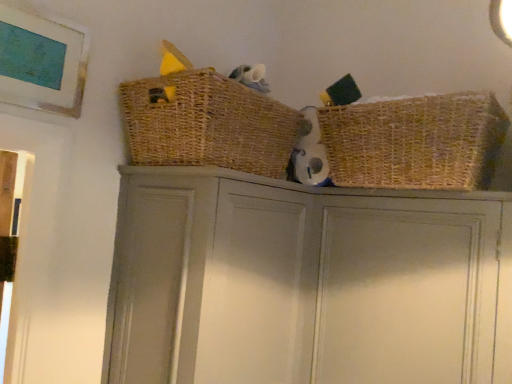
What do you see at coordinates (399, 297) in the screenshot? This screenshot has height=384, width=512. I see `matte gray cabinet door at upper center` at bounding box center [399, 297].

Describe the element at coordinates (415, 142) in the screenshot. This screenshot has height=384, width=512. I see `woven straw basket at upper right, acting as the 2th basket starting from the left` at that location.

You are a GUI agent. You are given a task and a screenshot of the screen. Output one action in this format:
    pyautogui.click(x=<x>, y=<y>)
    Task: Click on the matte gray cabinet door at upper center
    This screenshot has width=512, height=384.
    Given the screenshot: What is the action you would take?
    pyautogui.click(x=399, y=297)

Looking at the image, does matte gray cupboard at center seem bigger or smaller compared to woven brown basket at upper center, the 2th basket when ordered from right to left?

In the image, matte gray cupboard at center appears to be larger than woven brown basket at upper center, the 2th basket when ordered from right to left.

Is matte gray cupboard at center oriented away from woven brown basket at upper center, the 2th basket when ordered from right to left?

matte gray cupboard at center is not turned away from woven brown basket at upper center, the 2th basket when ordered from right to left.

Is matte gray cupboard at center completely or partially outside of woven brown basket at upper center, marked as the 1th basket in a left-to-right arrangement?

Absolutely, matte gray cupboard at center is external to woven brown basket at upper center, marked as the 1th basket in a left-to-right arrangement.

Is matte gray cupboard at center taller or shorter than woven brown basket at upper center, the 2th basket when ordered from right to left?

Considering their sizes, matte gray cupboard at center has more height than woven brown basket at upper center, the 2th basket when ordered from right to left.

Considering the relative positions of matte gray cabinet door at upper center and woven brown basket at upper center, the 2th basket when ordered from right to left, in the image provided, is matte gray cabinet door at upper center to the right of woven brown basket at upper center, the 2th basket when ordered from right to left, from the viewer's perspective?

Correct, you'll find matte gray cabinet door at upper center to the right of woven brown basket at upper center, the 2th basket when ordered from right to left.

Considering the relative sizes of matte gray cabinet door at upper center and woven brown basket at upper center, the 2th basket when ordered from right to left, in the image provided, is matte gray cabinet door at upper center thinner than woven brown basket at upper center, the 2th basket when ordered from right to left,?

Correct, the width of matte gray cabinet door at upper center is less than that of woven brown basket at upper center, the 2th basket when ordered from right to left.

Between matte gray cabinet door at upper center and woven brown basket at upper center, the 2th basket when ordered from right to left, which one has smaller size?

With smaller size is woven brown basket at upper center, the 2th basket when ordered from right to left.

Measure the distance between matte gray cupboard at center and woven straw basket at upper right, the first basket in the right-to-left sequence.

matte gray cupboard at center and woven straw basket at upper right, the first basket in the right-to-left sequence, are 26.23 centimeters apart.

Is point (474, 322) positioned in front of point (383, 121)?

Yes, it is in front of point (383, 121).

Which is correct: matte gray cupboard at center is inside woven straw basket at upper right, the first basket in the right-to-left sequence, or outside of it?

matte gray cupboard at center is not inside woven straw basket at upper right, the first basket in the right-to-left sequence, it's outside.

Who is taller, matte gray cupboard at center or woven straw basket at upper right, the first basket in the right-to-left sequence?

matte gray cupboard at center is taller.

Where is `the 2nd basket behind the matte gray cupboard at center, counting from the anchor's position`? The height and width of the screenshot is (384, 512). the 2nd basket behind the matte gray cupboard at center, counting from the anchor's position is located at coordinates (415, 142).

Is matte gray cupboard at center at the back of woven straw basket at upper right, the first basket in the right-to-left sequence?

No, woven straw basket at upper right, the first basket in the right-to-left sequence, is not facing away from matte gray cupboard at center.

Is woven straw basket at upper right, the first basket in the right-to-left sequence, far from matte gray cupboard at center?

woven straw basket at upper right, the first basket in the right-to-left sequence, is actually quite close to matte gray cupboard at center.

Between woven straw basket at upper right, the first basket in the right-to-left sequence, and matte gray cupboard at center, which one has less height?

With less height is woven straw basket at upper right, the first basket in the right-to-left sequence.

Can you tell me how much woven straw basket at upper right, the first basket in the right-to-left sequence, and woven brown basket at upper center, the 2th basket when ordered from right to left, differ in facing direction?

The angle between the facing direction of woven straw basket at upper right, the first basket in the right-to-left sequence, and the facing direction of woven brown basket at upper center, the 2th basket when ordered from right to left, is 90.7 degrees.

Can you confirm if woven straw basket at upper right, acting as the 2th basket starting from the left, is positioned to the right of woven brown basket at upper center, the 2th basket when ordered from right to left?

Yes, woven straw basket at upper right, acting as the 2th basket starting from the left, is to the right of woven brown basket at upper center, the 2th basket when ordered from right to left.

Looking at this image, which object is wider, woven straw basket at upper right, the first basket in the right-to-left sequence, or woven brown basket at upper center, marked as the 1th basket in a left-to-right arrangement?

woven brown basket at upper center, marked as the 1th basket in a left-to-right arrangement.

Is woven straw basket at upper right, the first basket in the right-to-left sequence, in contact with woven brown basket at upper center, the 2th basket when ordered from right to left?

No.

Does woven brown basket at upper center, marked as the 1th basket in a left-to-right arrangement, have a smaller size compared to matte gray cupboard at center?

Yes, woven brown basket at upper center, marked as the 1th basket in a left-to-right arrangement, is smaller than matte gray cupboard at center.

Can you tell me how much woven brown basket at upper center, marked as the 1th basket in a left-to-right arrangement, and matte gray cupboard at center differ in facing direction?

0.786 degrees.

Can you confirm if woven brown basket at upper center, marked as the 1th basket in a left-to-right arrangement, is taller than matte gray cupboard at center?

No.

From a real-world perspective, is woven brown basket at upper center, marked as the 1th basket in a left-to-right arrangement, located beneath matte gray cupboard at center?

No, from a real-world perspective, woven brown basket at upper center, marked as the 1th basket in a left-to-right arrangement, is not under matte gray cupboard at center.

You are a GUI agent. You are given a task and a screenshot of the screen. Output one action in this format:
    pyautogui.click(x=<x>, y=<y>)
    Task: Click on the 1st basket located above the matte gray cabinet door at upper center (from a real-world perspective)
    
    Given the screenshot: What is the action you would take?
    pyautogui.click(x=415, y=142)

Based on the photo, from the image's perspective, would you say woven straw basket at upper right, the first basket in the right-to-left sequence, is shown under matte gray cabinet door at upper center?

Incorrect, from the image's perspective, woven straw basket at upper right, the first basket in the right-to-left sequence, is higher than matte gray cabinet door at upper center.

Is woven straw basket at upper right, acting as the 2th basket starting from the left, wider than matte gray cabinet door at upper center?

Yes, woven straw basket at upper right, acting as the 2th basket starting from the left, is wider than matte gray cabinet door at upper center.

From the image's perspective, which basket is the 2nd one above the matte gray cupboard at center? Please provide its 2D coordinates.

[(207, 124)]

What are the coordinates of `door that appears below the woven brown basket at upper center, the 2th basket when ordered from right to left (from a real-world perspective)` in the screenshot? It's located at (399, 297).

Which object lies further to the anchor point woven straw basket at upper right, acting as the 2th basket starting from the left, woven brown basket at upper center, the 2th basket when ordered from right to left, or matte gray cabinet door at upper center?

woven brown basket at upper center, the 2th basket when ordered from right to left.

Looking at the image, which one is located closer to matte gray cabinet door at upper center, woven brown basket at upper center, the 2th basket when ordered from right to left, or matte gray cupboard at center?

Among the two, matte gray cupboard at center is located nearer to matte gray cabinet door at upper center.

When comparing their distances from matte gray cupboard at center, does matte gray cabinet door at upper center or woven straw basket at upper right, acting as the 2th basket starting from the left, seem further?

woven straw basket at upper right, acting as the 2th basket starting from the left, lies further to matte gray cupboard at center than the other object.

When comparing their distances from woven straw basket at upper right, acting as the 2th basket starting from the left, does matte gray cabinet door at upper center or matte gray cupboard at center seem further?

The object further to woven straw basket at upper right, acting as the 2th basket starting from the left, is matte gray cupboard at center.

Which object lies nearer to the anchor point matte gray cupboard at center, woven brown basket at upper center, the 2th basket when ordered from right to left, or matte gray cabinet door at upper center?

matte gray cabinet door at upper center.

Consider the image. Based on their spatial positions, is matte gray cabinet door at upper center or woven brown basket at upper center, the 2th basket when ordered from right to left, further from woven straw basket at upper right, acting as the 2th basket starting from the left?

woven brown basket at upper center, the 2th basket when ordered from right to left, is positioned further to the anchor woven straw basket at upper right, acting as the 2th basket starting from the left.

Estimate the real-world distances between objects in this image. Which object is closer to matte gray cabinet door at upper center, matte gray cupboard at center or woven brown basket at upper center, the 2th basket when ordered from right to left?

matte gray cupboard at center lies closer to matte gray cabinet door at upper center than the other object.

Looking at the image, which one is located closer to woven brown basket at upper center, the 2th basket when ordered from right to left, matte gray cupboard at center or woven straw basket at upper right, acting as the 2th basket starting from the left?

matte gray cupboard at center.

The image size is (512, 384). What are the coordinates of `door between woven brown basket at upper center, marked as the 1th basket in a left-to-right arrangement, and matte gray cupboard at center in the up-down direction` in the screenshot? It's located at (399, 297).

Find the location of a particular element. The width and height of the screenshot is (512, 384). basket between woven brown basket at upper center, the 2th basket when ordered from right to left, and matte gray cupboard at center, in the vertical direction is located at coordinates (415, 142).

Locate an element on the screen. door situated between matte gray cupboard at center and woven straw basket at upper right, the first basket in the right-to-left sequence, from left to right is located at coordinates coord(399,297).

Where is `door situated between woven brown basket at upper center, marked as the 1th basket in a left-to-right arrangement, and woven straw basket at upper right, the first basket in the right-to-left sequence, from left to right`? door situated between woven brown basket at upper center, marked as the 1th basket in a left-to-right arrangement, and woven straw basket at upper right, the first basket in the right-to-left sequence, from left to right is located at coordinates (399, 297).